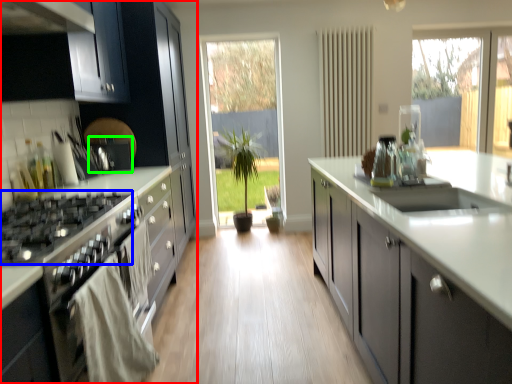
Question: Which object is positioned closest to cabinetry (highlighted by a red box)? Select from gas stove (highlighted by a blue box) and appliance (highlighted by a green box).

Choices:
 (A) gas stove
 (B) appliance

Answer: (B)